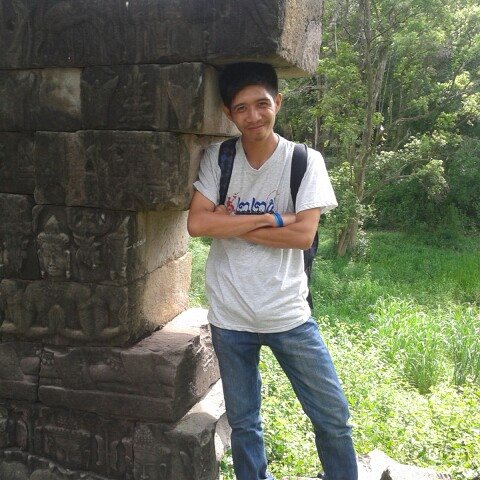
Image resolution: width=480 pixels, height=480 pixels. Identify the location of highlighted areas of stone wall. (216, 405), (194, 320), (163, 241), (170, 288), (223, 439), (298, 35), (315, 42).